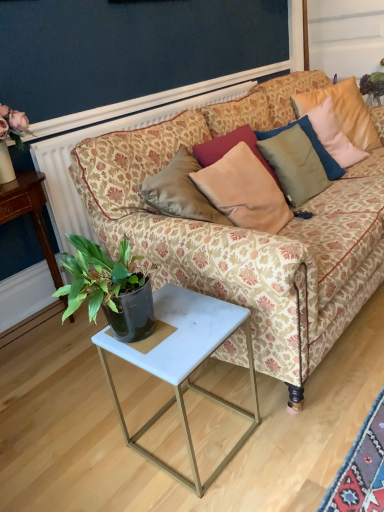
Question: Should I look upward or downward to see satin beige pillow at upper center, the 2th pillow viewed from the right?

Choices:
 (A) down
 (B) up

Answer: (B)

Question: Is satin beige pillow at center, the 1th pillow in the left-to-right sequence, not near patterned fabric couch at center?

Choices:
 (A) no
 (B) yes

Answer: (A)

Question: From the image's perspective, is satin beige pillow at center, the 1th pillow in the left-to-right sequence, over patterned fabric couch at center?

Choices:
 (A) yes
 (B) no

Answer: (A)

Question: Is satin beige pillow at center, the 1th pillow in the left-to-right sequence, touching patterned fabric couch at center?

Choices:
 (A) no
 (B) yes

Answer: (A)

Question: From a real-world perspective, is satin beige pillow at center, the 3th pillow viewed from the right, below patterned fabric couch at center?

Choices:
 (A) no
 (B) yes

Answer: (A)

Question: From the image's perspective, is satin beige pillow at center, the 3th pillow viewed from the right, below patterned fabric couch at center?

Choices:
 (A) no
 (B) yes

Answer: (A)

Question: Is satin beige pillow at center, the 3th pillow viewed from the right, oriented away from patterned fabric couch at center?

Choices:
 (A) no
 (B) yes

Answer: (B)

Question: Is satin beige pillow at center, the 3th pillow viewed from the right, wider than dark blue wall at upper center?

Choices:
 (A) yes
 (B) no

Answer: (A)

Question: From a real-world perspective, is satin beige pillow at center, the 3th pillow viewed from the right, positioned over dark blue wall at upper center based on gravity?

Choices:
 (A) yes
 (B) no

Answer: (B)

Question: Are satin beige pillow at center, the 1th pillow in the left-to-right sequence, and dark blue wall at upper center located far from each other?

Choices:
 (A) no
 (B) yes

Answer: (B)

Question: Can dark blue wall at upper center be found inside satin beige pillow at center, the 1th pillow in the left-to-right sequence?

Choices:
 (A) yes
 (B) no

Answer: (B)

Question: Does satin beige pillow at center, the 3th pillow viewed from the right, have a lesser width compared to dark blue wall at upper center?

Choices:
 (A) no
 (B) yes

Answer: (A)

Question: From the image's perspective, is satin beige pillow at center, the 1th pillow in the left-to-right sequence, below dark blue wall at upper center?

Choices:
 (A) no
 (B) yes

Answer: (B)

Question: Considering the relative sizes of dark blue wall at upper center and patterned fabric couch at center in the image provided, is dark blue wall at upper center shorter than patterned fabric couch at center?

Choices:
 (A) no
 (B) yes

Answer: (B)